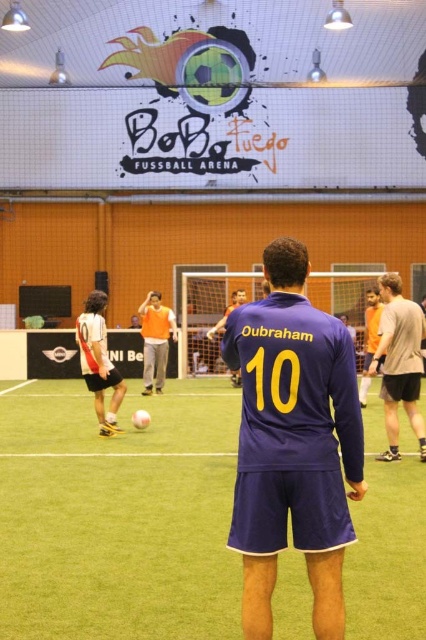
Which is behind, point (282, 376) or point (155, 346)?

Positioned behind is point (155, 346).

Can you confirm if yellow matte/texture number at center is positioned to the left of orange jersey at center?

In fact, yellow matte/texture number at center is to the right of orange jersey at center.

This screenshot has width=426, height=640. I want to click on yellow matte/texture number at center, so click(x=275, y=380).

Can you confirm if gray cotton shirt at right is wider than yellow matte/texture number at center?

Yes, gray cotton shirt at right is wider than yellow matte/texture number at center.

Is gray cotton shirt at right smaller than yellow matte/texture number at center?

No.

Identify the location of gray cotton shirt at right. This screenshot has width=426, height=640. (400, 362).

Which is more to the right, green artificial turf at center or yellow matte/texture number at center?

yellow matte/texture number at center

Does point (354, 564) come closer to viewer compared to point (264, 355)?

No, it is behind (264, 355).

Find the location of a particular element. The image size is (426, 640). green artificial turf at center is located at coordinates (118, 515).